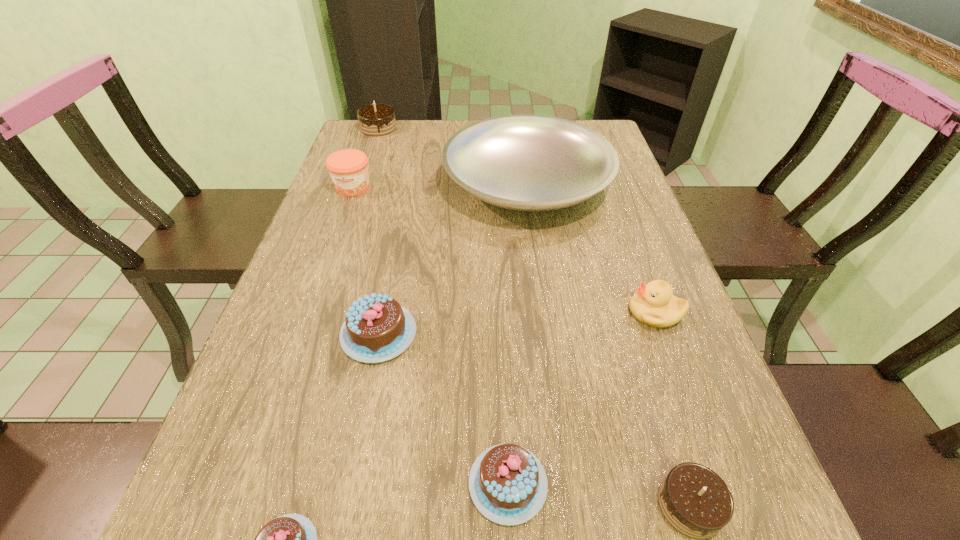
Locate an element on the screen. the bigger chocolate chocolate cake is located at coordinates (375, 119).

What are the coordinates of `the farther chocolate chocolate cake` in the screenshot? It's located at (375, 119).

At what (x,y) coordinates should I click in order to perform the action: click on bedpan. Please return your answer as a coordinate pair (x, y). Looking at the image, I should click on (523, 162).

I want to click on jam, so click(348, 168).

The width and height of the screenshot is (960, 540). Find the location of `yellow duckling`. yellow duckling is located at coordinates (654, 304).

Locate an element on the screen. The width and height of the screenshot is (960, 540). the biggest pink chocolate cake is located at coordinates (377, 328).

Where is `the farthest pink chocolate cake`? This screenshot has height=540, width=960. the farthest pink chocolate cake is located at coordinates (377, 328).

Image resolution: width=960 pixels, height=540 pixels. I want to click on the rightmost chocolate cake, so click(695, 501).

The image size is (960, 540). Identify the location of the smaller chocolate chocolate cake. (695, 501).

Find the location of `the second smallest pink chocolate cake`. the second smallest pink chocolate cake is located at coordinates (508, 484).